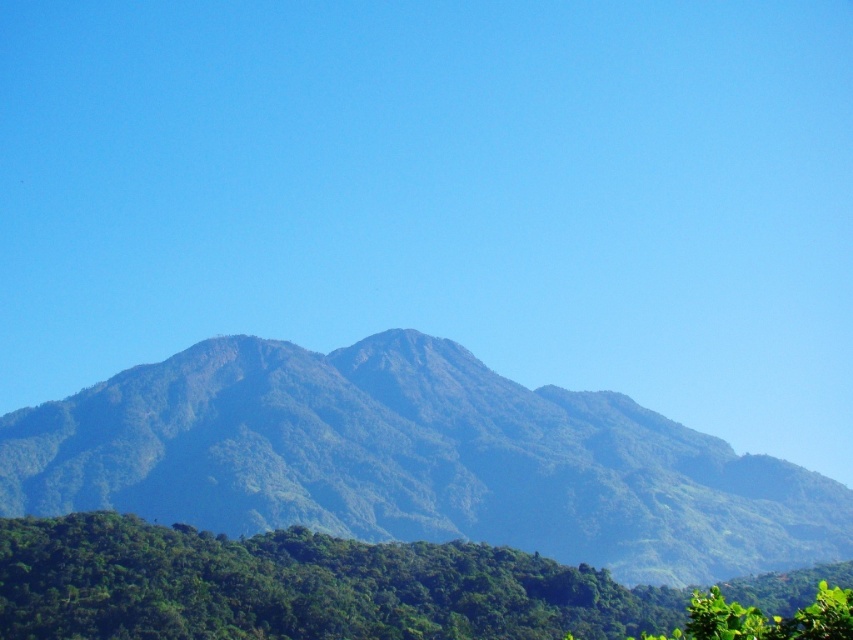
You are standing in the dense forest at the foreground of the mountain scene. You notice two points in the distance. The first point is located at coordinates point (627, 568), and the second point is at point (30, 628). Which point is closer to you?

Point (30, 628) is closer to you because it is in front of point (627, 568) according to their spatial arrangement.